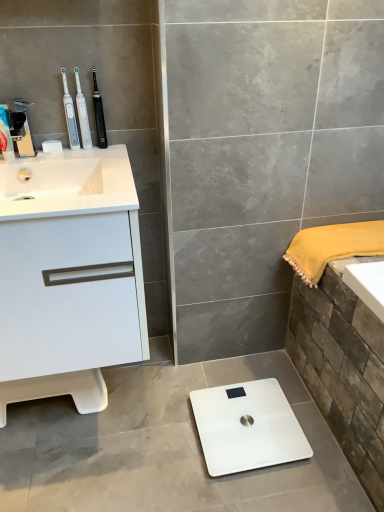
Question: Considering the relative sizes of white plastic toothbrush at upper left, the 2th toothbrush when ordered from right to left, and white glossy cabinet at left in the image provided, is white plastic toothbrush at upper left, the 2th toothbrush when ordered from right to left, bigger than white glossy cabinet at left?

Choices:
 (A) yes
 (B) no

Answer: (B)

Question: From a real-world perspective, is white plastic toothbrush at upper left, the 2th toothbrush when ordered from right to left, below white glossy cabinet at left?

Choices:
 (A) yes
 (B) no

Answer: (B)

Question: Is white glossy cabinet at left a part of white plastic toothbrush at upper left, which ranks as the second toothbrush in left-to-right order?

Choices:
 (A) yes
 (B) no

Answer: (B)

Question: From a real-world perspective, is white plastic toothbrush at upper left, which ranks as the second toothbrush in left-to-right order, positioned over white glossy cabinet at left based on gravity?

Choices:
 (A) yes
 (B) no

Answer: (A)

Question: From the image's perspective, is white plastic toothbrush at upper left, the 2th toothbrush when ordered from right to left, on white glossy cabinet at left?

Choices:
 (A) yes
 (B) no

Answer: (A)

Question: From the image's perspective, is brushed metal faucet at upper left, which is the 2th toiletry from left to right, above or below white plastic toothbrush at upper left, the 2th toothbrush when ordered from right to left?

Choices:
 (A) below
 (B) above

Answer: (A)

Question: In the image, is brushed metal faucet at upper left, the 1th toiletry positioned from the right, positioned in front of or behind white plastic toothbrush at upper left, which ranks as the second toothbrush in left-to-right order?

Choices:
 (A) front
 (B) behind

Answer: (A)

Question: In terms of size, does brushed metal faucet at upper left, the 1th toiletry positioned from the right, appear bigger or smaller than white plastic toothbrush at upper left, which ranks as the second toothbrush in left-to-right order?

Choices:
 (A) small
 (B) big

Answer: (B)

Question: Considering the positions of brushed metal faucet at upper left, the 1th toiletry positioned from the right, and white plastic toothbrush at upper left, which ranks as the second toothbrush in left-to-right order, in the image, is brushed metal faucet at upper left, the 1th toiletry positioned from the right, wider or thinner than white plastic toothbrush at upper left, which ranks as the second toothbrush in left-to-right order,?

Choices:
 (A) thin
 (B) wide

Answer: (B)

Question: Based on their positions, is white glossy cabinet at left located to the left or right of black plastic toothbrush at upper center, acting as the 3th toothbrush starting from the left?

Choices:
 (A) left
 (B) right

Answer: (A)

Question: From their relative heights in the image, would you say white glossy cabinet at left is taller or shorter than black plastic toothbrush at upper center, which is the 1th toothbrush in right-to-left order?

Choices:
 (A) tall
 (B) short

Answer: (A)

Question: Is point (44, 261) positioned closer to the camera than point (104, 128)?

Choices:
 (A) closer
 (B) farther

Answer: (A)

Question: In terms of width, does white glossy cabinet at left look wider or thinner when compared to black plastic toothbrush at upper center, acting as the 3th toothbrush starting from the left?

Choices:
 (A) thin
 (B) wide

Answer: (B)

Question: Is brushed metal faucet at upper left, which is the 2th toiletry from left to right, taller or shorter than matte plastic toothpaste tube at left, the first toiletry when ordered from left to right?

Choices:
 (A) short
 (B) tall

Answer: (B)

Question: Is brushed metal faucet at upper left, the 1th toiletry positioned from the right, to the left or to the right of matte plastic toothpaste tube at left, the 2th toiletry viewed from the right, in the image?

Choices:
 (A) left
 (B) right

Answer: (B)